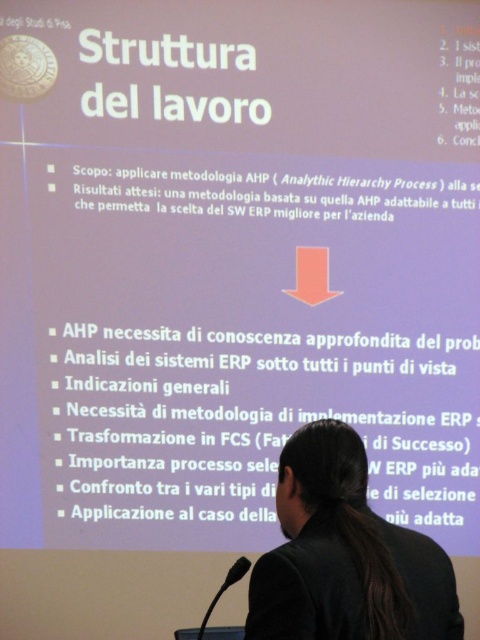
Question: Does black hair at center appear on the right side of black plastic microphone at lower center?

Choices:
 (A) yes
 (B) no

Answer: (A)

Question: Which point is closer to the camera?

Choices:
 (A) (301, 632)
 (B) (214, 600)

Answer: (A)

Question: Does black hair at center appear under black plastic microphone at lower center?

Choices:
 (A) yes
 (B) no

Answer: (B)

Question: Which of the following is the closest to the observer?

Choices:
 (A) (372, 573)
 (B) (237, 572)

Answer: (A)

Question: Is black hair at center to the left of black plastic microphone at lower center from the viewer's perspective?

Choices:
 (A) yes
 (B) no

Answer: (B)